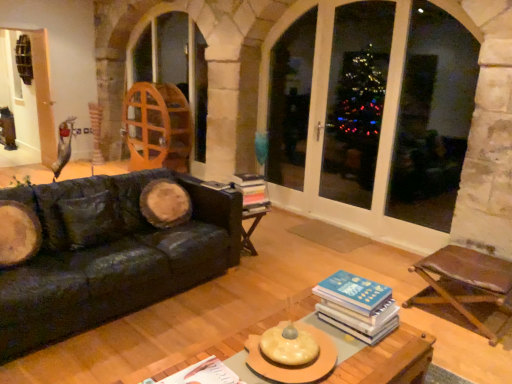
Question: Can you confirm if black leather couch at left is bigger than brown leather chair at lower right?

Choices:
 (A) yes
 (B) no

Answer: (A)

Question: Can you confirm if black leather couch at left is shorter than brown leather chair at lower right?

Choices:
 (A) no
 (B) yes

Answer: (A)

Question: From a real-world perspective, is black leather couch at left beneath brown leather chair at lower right?

Choices:
 (A) no
 (B) yes

Answer: (A)

Question: Is black leather couch at left closer to the viewer compared to brown leather chair at lower right?

Choices:
 (A) yes
 (B) no

Answer: (A)

Question: Considering the relative positions of black leather couch at left and brown leather chair at lower right in the image provided, is black leather couch at left to the left of brown leather chair at lower right from the viewer's perspective?

Choices:
 (A) no
 (B) yes

Answer: (B)

Question: Is transparent glass window at center bigger or smaller than transparent glass screen door at center, the 1th screen door positioned from the right?

Choices:
 (A) big
 (B) small

Answer: (B)

Question: From the image's perspective, relative to transparent glass screen door at center, positioned as the second screen door in back-to-front order, is transparent glass window at center above or below?

Choices:
 (A) above
 (B) below

Answer: (B)

Question: Is point (387, 195) closer or farther from the camera than point (368, 13)?

Choices:
 (A) closer
 (B) farther

Answer: (A)

Question: From a real-world perspective, is transparent glass window at center positioned above or below transparent glass screen door at center, the second screen door positioned from the left?

Choices:
 (A) above
 (B) below

Answer: (A)

Question: From a real-world perspective, is black leather couch at left above or below transparent glass screen door at center, positioned as the second screen door in back-to-front order?

Choices:
 (A) above
 (B) below

Answer: (B)

Question: Is black leather couch at left in front of or behind transparent glass screen door at center, the 1th screen door positioned from the right, in the image?

Choices:
 (A) front
 (B) behind

Answer: (A)

Question: Choose the correct answer: Is black leather couch at left inside transparent glass screen door at center, positioned as the second screen door in back-to-front order, or outside it?

Choices:
 (A) inside
 (B) outside

Answer: (B)

Question: From the image's perspective, is black leather couch at left positioned above or below transparent glass screen door at center, the second screen door positioned from the left?

Choices:
 (A) above
 (B) below

Answer: (B)

Question: In terms of width, does white paper book at center, the third book in the right-to-left sequence, look wider or thinner when compared to transparent glass window at center?

Choices:
 (A) thin
 (B) wide

Answer: (B)

Question: Considering the positions of white paper book at center, the 1th book when ordered from left to right, and transparent glass window at center in the image, is white paper book at center, the 1th book when ordered from left to right, taller or shorter than transparent glass window at center?

Choices:
 (A) tall
 (B) short

Answer: (B)